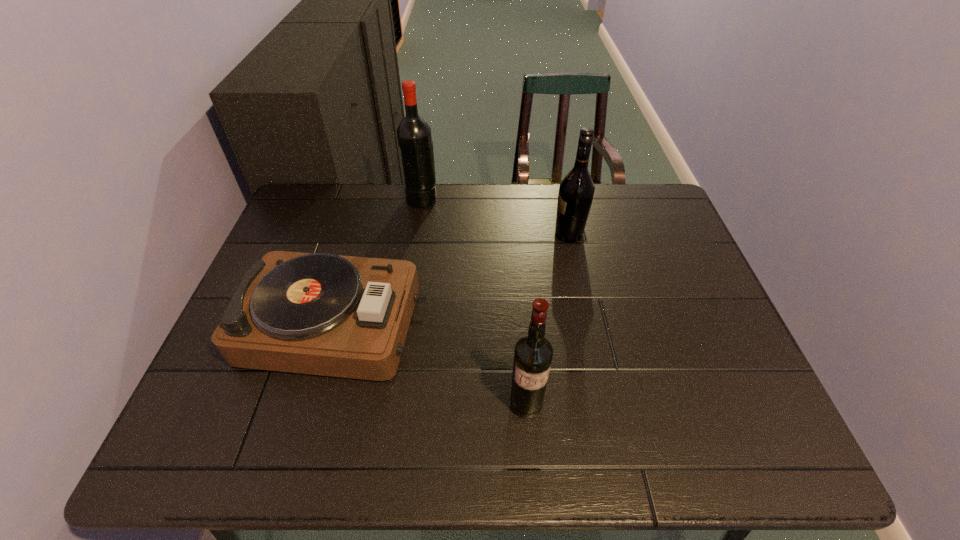
I want to click on free space that satisfies the following two spatial constraints: 1. on the label of the third nearest object; 2. on the front and back of the nearest wine bottle, so pos(605,404).

Identify the location of vacant position in the image that satisfies the following two spatial constraints: 1. on the label of the rightmost object; 2. on the front and back of the nearest object. The width and height of the screenshot is (960, 540). (605, 404).

In order to click on vacant position in the image that satisfies the following two spatial constraints: 1. on the label of the second farthest object; 2. on the front and back of the third object from left to right in this screenshot , I will do `click(605, 404)`.